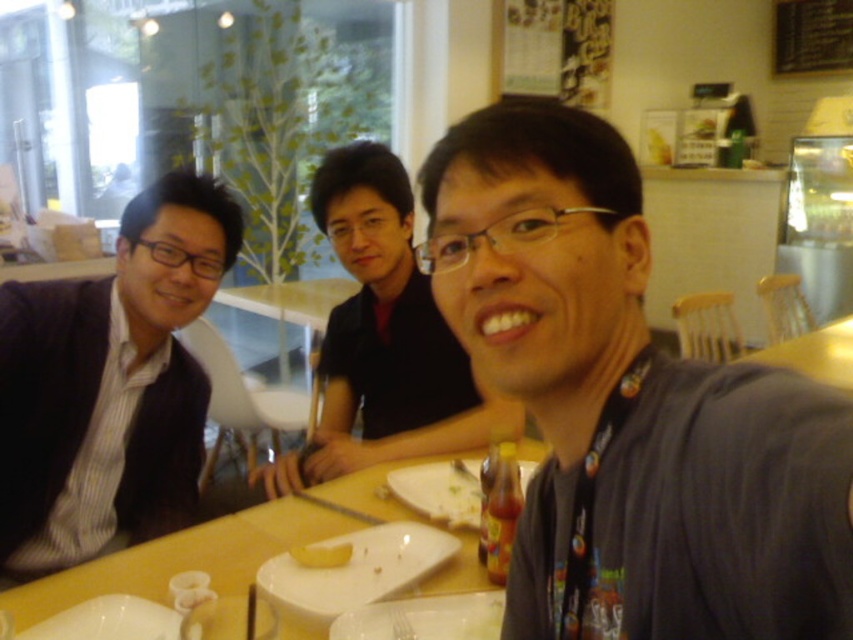
Can you confirm if matte black suit at left is bigger than matte black shirt at center?

No, matte black suit at left is not bigger than matte black shirt at center.

Between matte black suit at left and matte black shirt at center, which one is positioned higher?

matte black shirt at center

I want to click on matte black suit at left, so click(109, 384).

Between gray fabric shirt at center and matte black shirt at center, which one has more height?

Standing taller between the two is matte black shirt at center.

Does gray fabric shirt at center have a greater height compared to matte black shirt at center?

Incorrect, gray fabric shirt at center's height is not larger of matte black shirt at center's.

Between point (846, 458) and point (396, 276), which one is positioned behind?

Positioned behind is point (396, 276).

Where is `gray fabric shirt at center`? This screenshot has width=853, height=640. gray fabric shirt at center is located at coordinates (630, 406).

Between wooden table at center and yellow matte bread at center, which one is positioned higher?

yellow matte bread at center

Is point (122, 586) behind point (311, 561)?

No, it is in front of (311, 561).

This screenshot has height=640, width=853. What do you see at coordinates (183, 557) in the screenshot?
I see `wooden table at center` at bounding box center [183, 557].

Identify the location of wooden table at center. This screenshot has width=853, height=640. (183, 557).